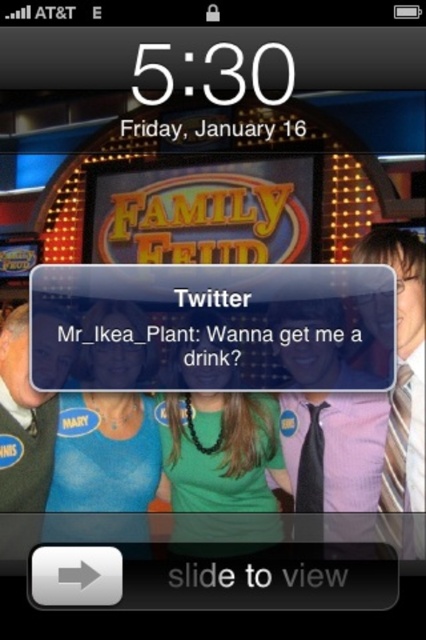
You are looking at a lock screen on a mobile device. The screen shows a Family Feud game show background with its logo and bright lights. There is a green matte necklace at center. Where exactly is the green matte necklace located on the screen?

The green matte necklace at center is located at point coordinates of (221, 468).

From the picture: You are looking at a lock screen on a mobile device. You notice two items displayed on the game show backdrop. The pink fabric tie at right and the gray sweater at left. Which item is positioned higher on the screen?

The pink fabric tie at right is positioned higher on the screen because it is above the gray sweater at left.

You are holding a 20 inch wide box. You need to place it between the pink fabric tie at right and gray sweater at left on the lock screen. Will the box fit between them without overlapping either item?

The distance between the pink fabric tie at right and gray sweater at left is 31.62 inches. Since the box is 20 inches wide, there is enough space to place it between them without overlapping.